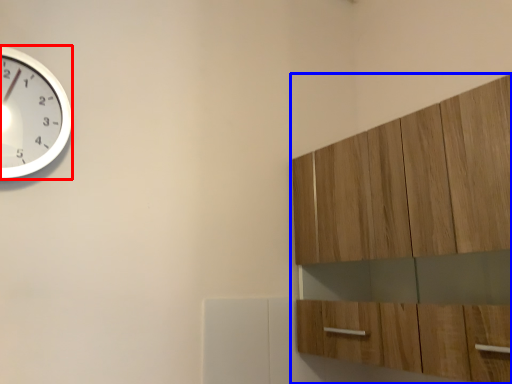
Question: Which object appears farthest to the camera in this image, wall clock (highlighted by a red box) or cabinetry (highlighted by a blue box)?

Choices:
 (A) wall clock
 (B) cabinetry

Answer: (A)